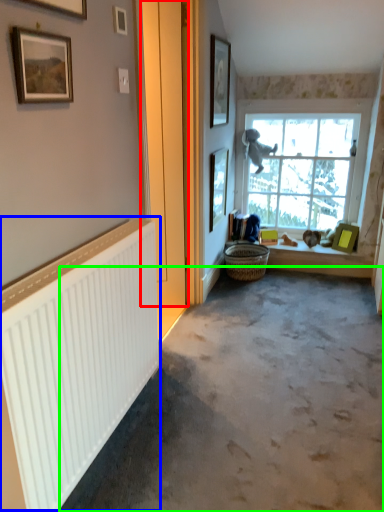
Question: Which object is the farthest from door (highlighted by a red box)? Choose among these: radiator (highlighted by a blue box) or concrete (highlighted by a green box).

Choices:
 (A) radiator
 (B) concrete

Answer: (A)